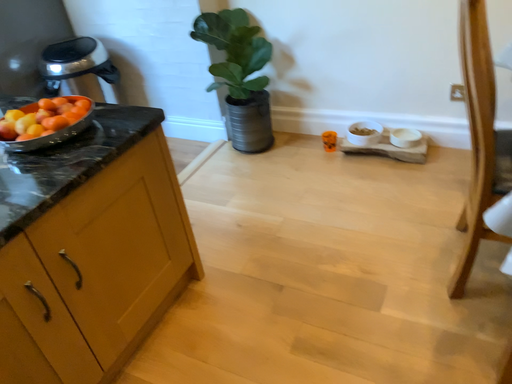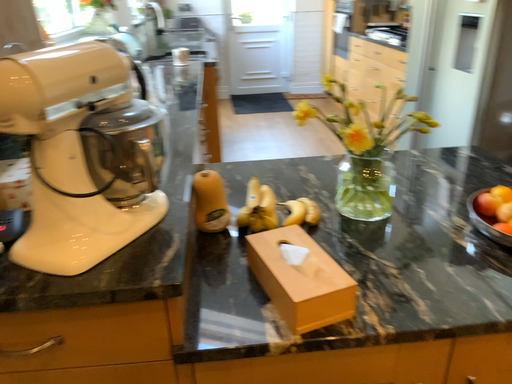
Question: Which way did the camera rotate in the video?

Choices:
 (A) rotated upward
 (B) rotated downward

Answer: (A)